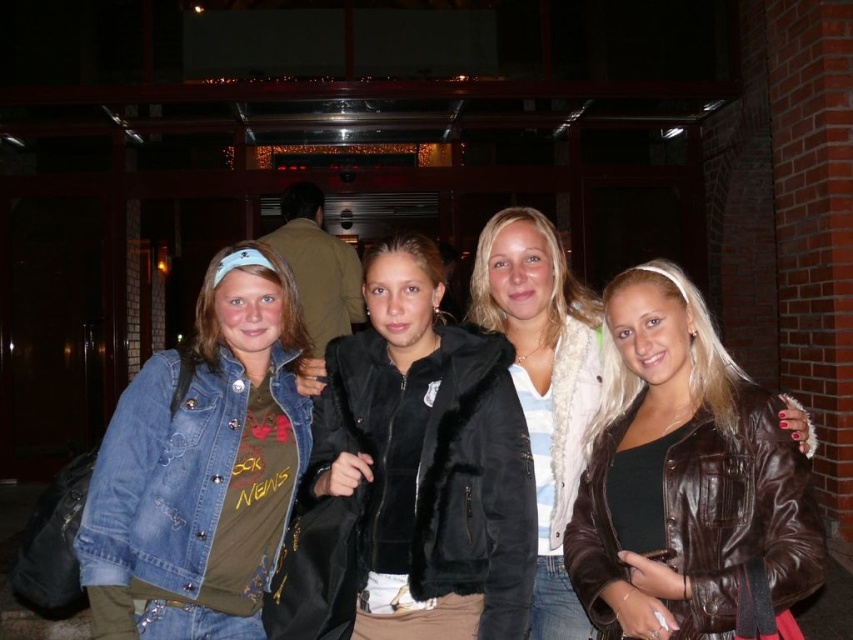
You are trying to decide which jacket to choose for a cold evening based on warmth. If the black fur jacket at center is taller than the brown leather jacket at right, which one might be warmer?

The black fur jacket at center might be warmer since it has a greater height compared to the brown leather jacket at right, suggesting it provides more coverage and insulation.

You are organizing a photo shoot and need to arrange two jackets in a display case. The display case has limited space. Based on the image, which jacket, the black fur jacket at center or the brown leather jacket at right, would require less space in the display case?

The black fur jacket at center occupies less space than the brown leather jacket at right, so it would require less space in the display case.